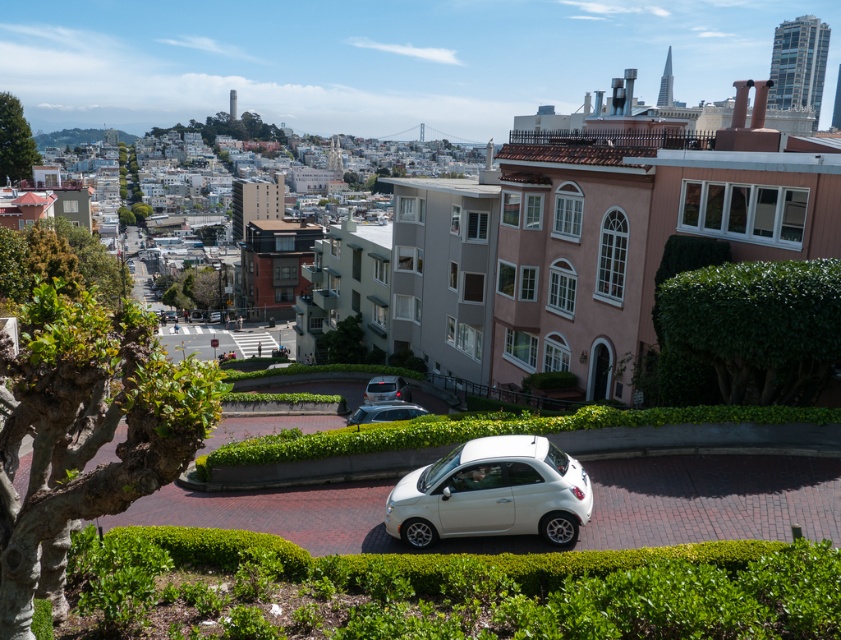
You are a delivery driver needing to pass through the city street shown in the image. You see a white matte car at center and a satin silver car at center. Which car should you overtake first to proceed smoothly?

The white matte car at center is in front of the satin silver car at center, so you should overtake the white matte car at center first to proceed smoothly.

You are a drone operator trying to capture a photo of the green leafy hedge at center and the white matte car at center. Which object should you focus on first if you want to ensure both are in sharp focus?

You should focus on the green leafy hedge at center first because it is closer to the viewer than the white matte car at center, so adjusting focus from near to far will help both be in sharp focus.